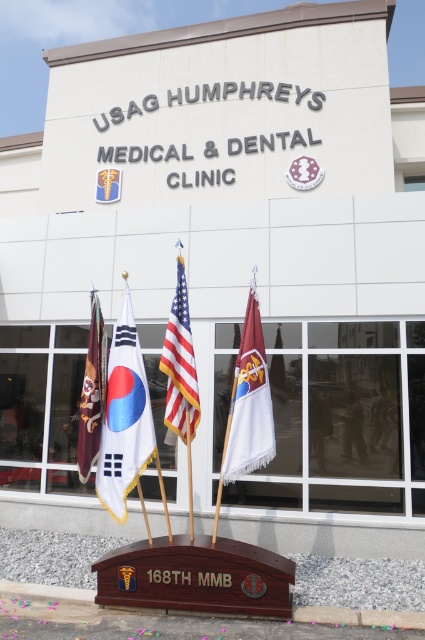
In the scene shown: You are a visitor approaching the USAG Humphreys Medical and Dental Clinic. You notice two flags in front of the building. The polished wood flag at center and the brown leather flag at left. Which flag is shorter?

The polished wood flag at center is shorter than the brown leather flag at left.